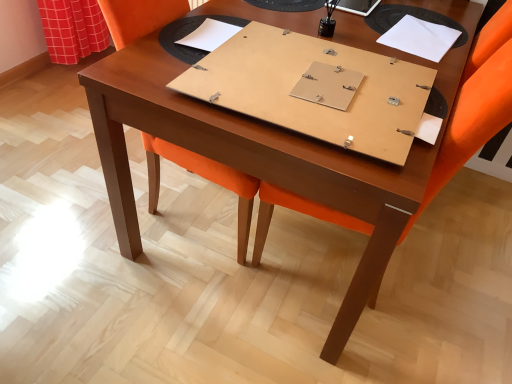
Question: From the image's perspective, is white cardboard notebook at upper center, marked as the first notebook in a left-to-right arrangement, positioned above or below matte wood notebook at center, positioned as the 2th notebook in right-to-left order?

Choices:
 (A) below
 (B) above

Answer: (B)

Question: In the image, is white cardboard notebook at upper center, marked as the first notebook in a left-to-right arrangement, on the left side or the right side of matte wood notebook at center, which is the 2th notebook from left to right?

Choices:
 (A) left
 (B) right

Answer: (A)

Question: Which of these objects is positioned farthest from the white cardboard notebook at upper center, placed as the 3th notebook when sorted from right to left?

Choices:
 (A) orange fabric chair at center
 (B) orange fabric swivel chair at center
 (C) white paper at upper right, which is the 1th notebook from right to left
 (D) matte wood notebook at center, which is the 2th notebook from left to right

Answer: (A)

Question: Which object is the farthest from the white cardboard notebook at upper center, placed as the 3th notebook when sorted from right to left?

Choices:
 (A) orange fabric swivel chair at center
 (B) matte wood notebook at center, which is the 2th notebook from left to right
 (C) white paper at upper right, acting as the 3th notebook starting from the left
 (D) orange fabric chair at center

Answer: (D)